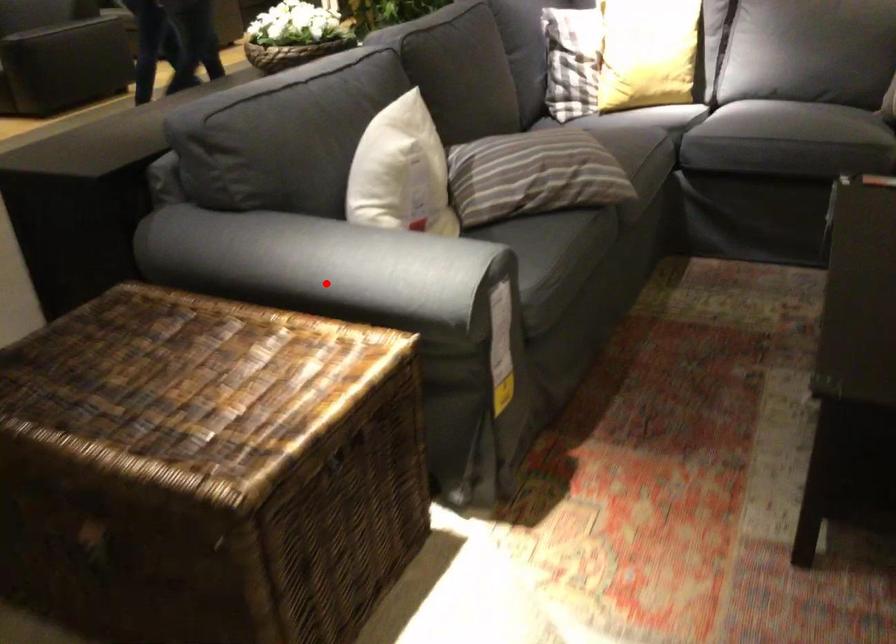
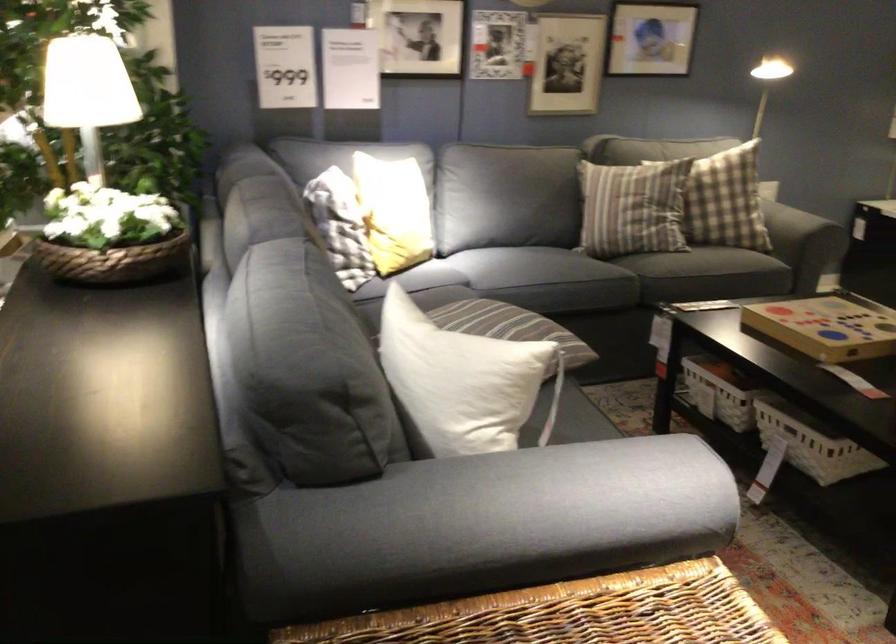
Question: I am providing you with two images of the same scene from different viewpoints. Image1 has a red point marked. In image2, the corresponding 3D location appears at what relative position? Reply with the corresponding letter.

Choices:
 (A) Closer
 (B) Farther

Answer: (A)